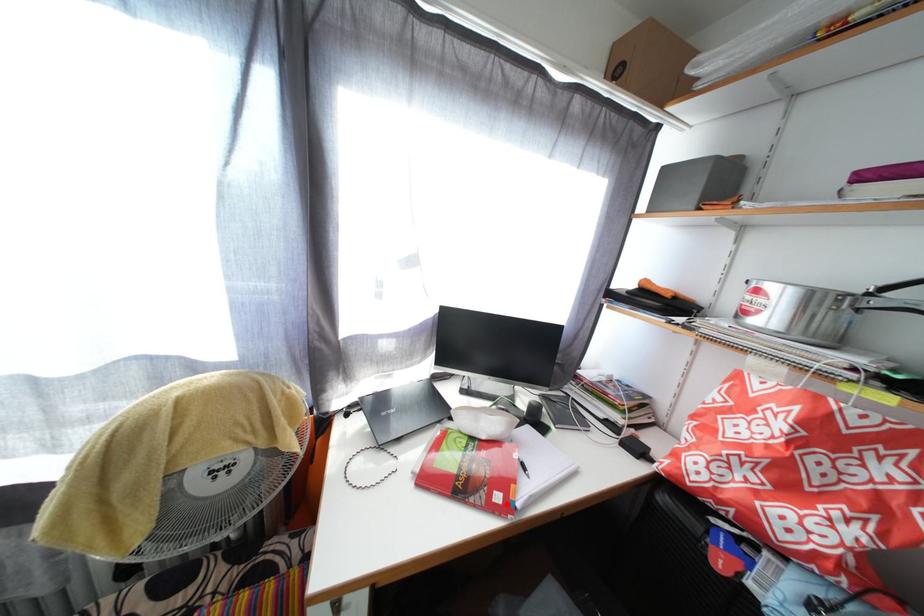
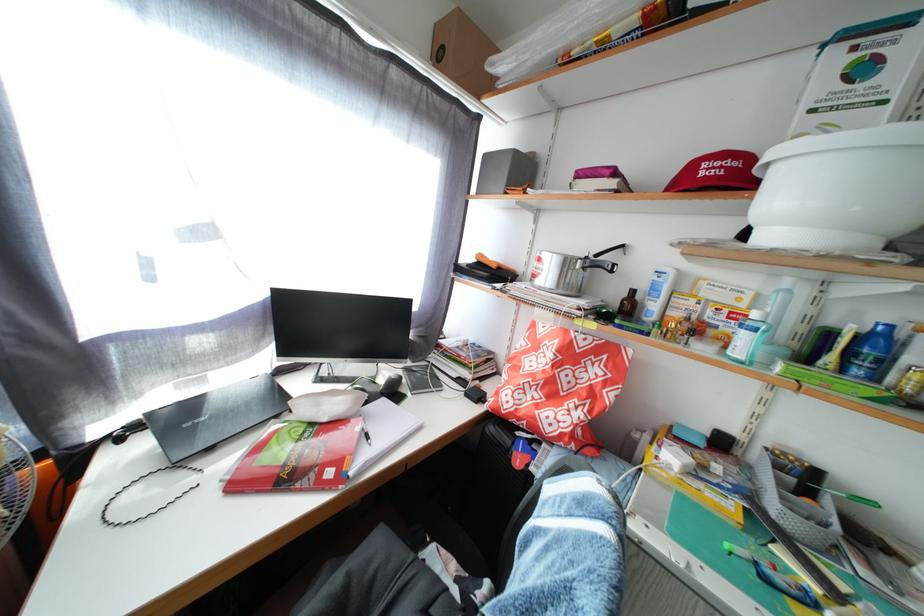
Where in the second image is the point corresponding to the highlighted location from the first image?

(338, 480)